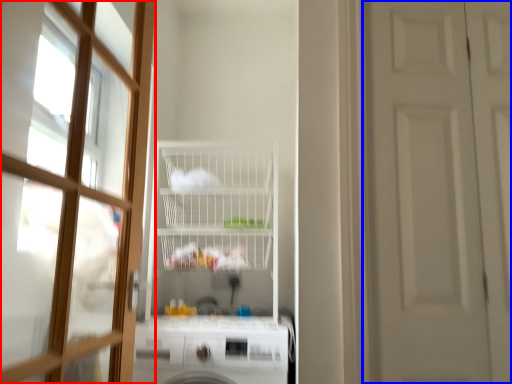
Question: Among these objects, which one is farthest to the camera, door (highlighted by a red box) or door (highlighted by a blue box)?

Choices:
 (A) door
 (B) door

Answer: (B)